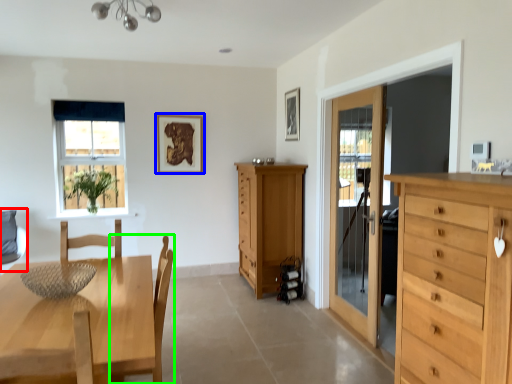
Question: Which is farther away from swivel chair (highlighted by a red box)? picture frame (highlighted by a blue box) or chair (highlighted by a green box)?

Choices:
 (A) picture frame
 (B) chair

Answer: (B)